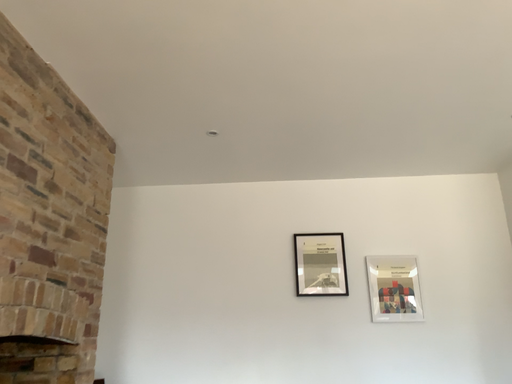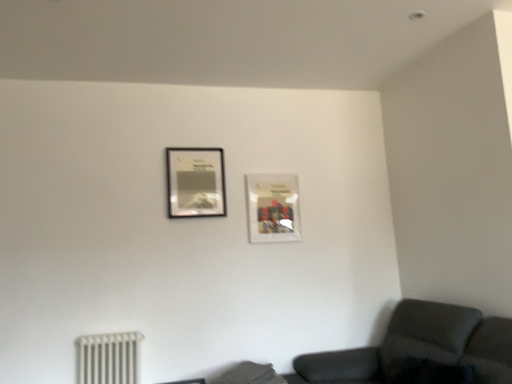
Question: Which way did the camera rotate in the video?

Choices:
 (A) rotated upward
 (B) rotated downward

Answer: (B)